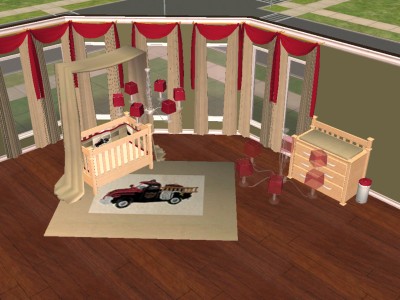
You are a GUI agent. You are given a task and a screenshot of the screen. Output one action in this format:
    pyautogui.click(x=<x>, y=<y>)
    Task: Click on the canopy
    The image size is (400, 300).
    Given the screenshot: What is the action you would take?
    pyautogui.click(x=104, y=60)